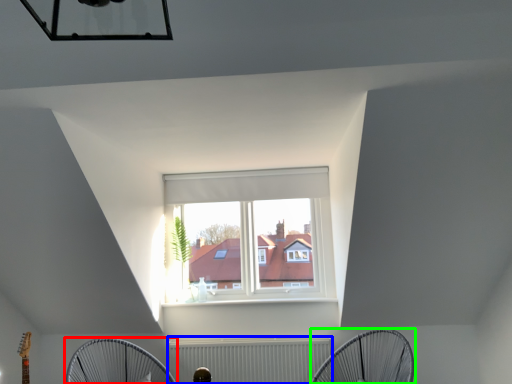
Question: Based on their relative distances, which object is nearer to mechanical fan (highlighted by a red box)? Choose from radiator (highlighted by a blue box) and mechanical fan (highlighted by a green box).

Choices:
 (A) radiator
 (B) mechanical fan

Answer: (A)